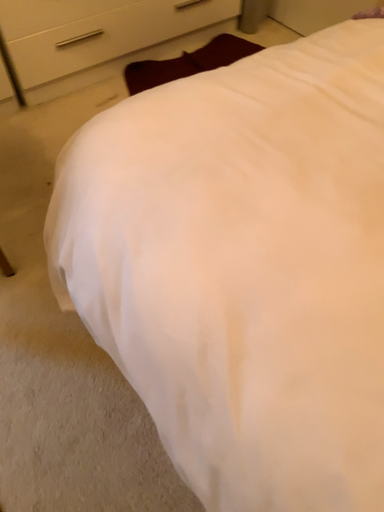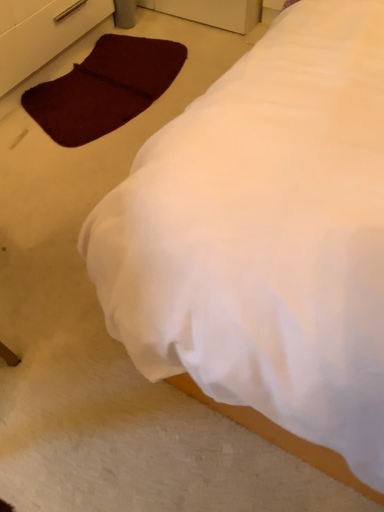
Question: How did the camera likely rotate when shooting the video?

Choices:
 (A) rotated left
 (B) rotated right

Answer: (B)